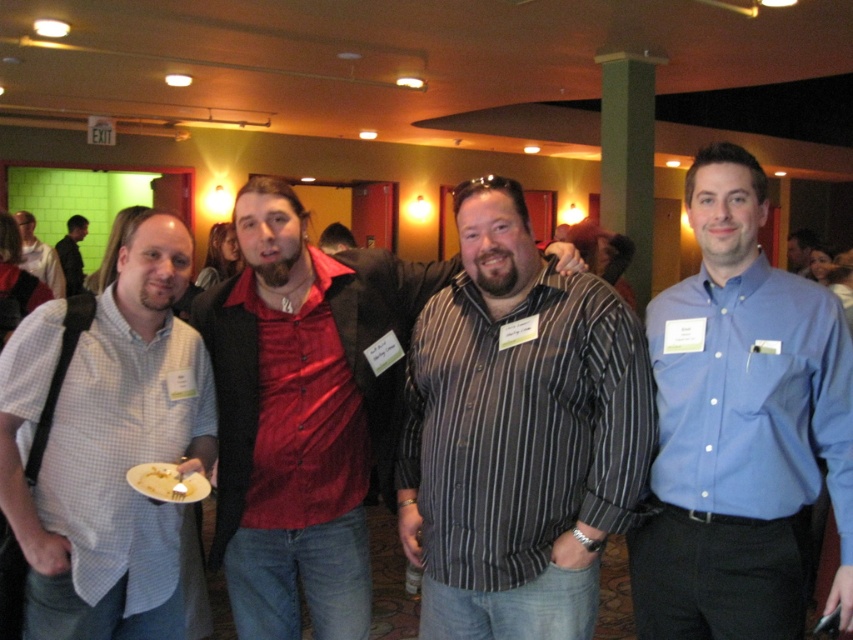
Question: Which object appears closest to the camera in this image?

Choices:
 (A) dark gray leather jacket at left
 (B) shiny red shirt at center
 (C) striped cotton shirt at center

Answer: (C)

Question: Which object appears farthest from the camera in this image?

Choices:
 (A) blue button-down shirt at center
 (B) red shirt at center

Answer: (B)

Question: Is striped cotton shirt at center bigger than white matte plate at lower left?

Choices:
 (A) yes
 (B) no

Answer: (A)

Question: Can you confirm if striped cotton shirt at center is positioned below matte black shirt at left?

Choices:
 (A) no
 (B) yes

Answer: (B)

Question: Can you confirm if blue button-down shirt at center is bigger than white matte plate at lower left?

Choices:
 (A) yes
 (B) no

Answer: (A)

Question: Among these points, which one is nearest to the camera?

Choices:
 (A) (640, 634)
 (B) (352, 241)
 (C) (799, 260)
 (D) (148, 474)

Answer: (D)